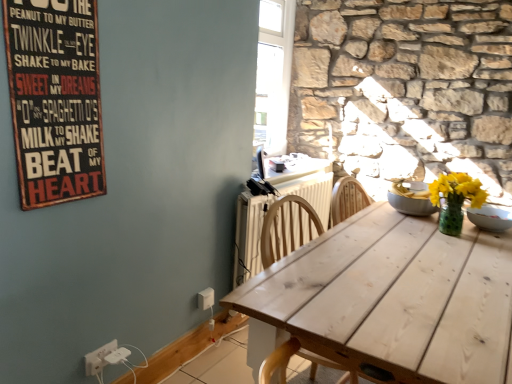
Question: Should I look upward or downward to see white wood table at center?

Choices:
 (A) down
 (B) up

Answer: (A)

Question: Can you confirm if white glossy bowl at upper right is smaller than white wood table at center?

Choices:
 (A) no
 (B) yes

Answer: (B)

Question: From a real-world perspective, is white glossy bowl at upper right on white wood table at center?

Choices:
 (A) no
 (B) yes

Answer: (B)

Question: Is white glossy bowl at upper right at the right side of white wood table at center?

Choices:
 (A) no
 (B) yes

Answer: (B)

Question: Does white glossy bowl at upper right lie behind white wood table at center?

Choices:
 (A) no
 (B) yes

Answer: (B)

Question: Could you tell me if white glossy bowl at upper right is turned towards white wood table at center?

Choices:
 (A) yes
 (B) no

Answer: (B)

Question: From the image's perspective, does white glossy bowl at upper right appear lower than white wood table at center?

Choices:
 (A) no
 (B) yes

Answer: (A)

Question: From the image's perspective, is white wood table at center over white glossy bowl at upper right?

Choices:
 (A) no
 (B) yes

Answer: (A)

Question: Is white glossy bowl at upper right completely or partially inside white wood table at center?

Choices:
 (A) yes
 (B) no

Answer: (B)

Question: Is white wood table at center smaller than white glossy bowl at upper right?

Choices:
 (A) no
 (B) yes

Answer: (A)

Question: From a real-world perspective, is white wood table at center positioned over white glossy bowl at upper right based on gravity?

Choices:
 (A) yes
 (B) no

Answer: (B)

Question: Can you confirm if white wood table at center is wider than white glossy bowl at upper right?

Choices:
 (A) no
 (B) yes

Answer: (B)

Question: Does white wood table at center have a lesser height compared to white glossy bowl at upper right?

Choices:
 (A) no
 (B) yes

Answer: (A)

Question: Is there a large distance between white plastic electric outlet at lower center, the second electric outlet from the left, and white wood table at center?

Choices:
 (A) no
 (B) yes

Answer: (B)